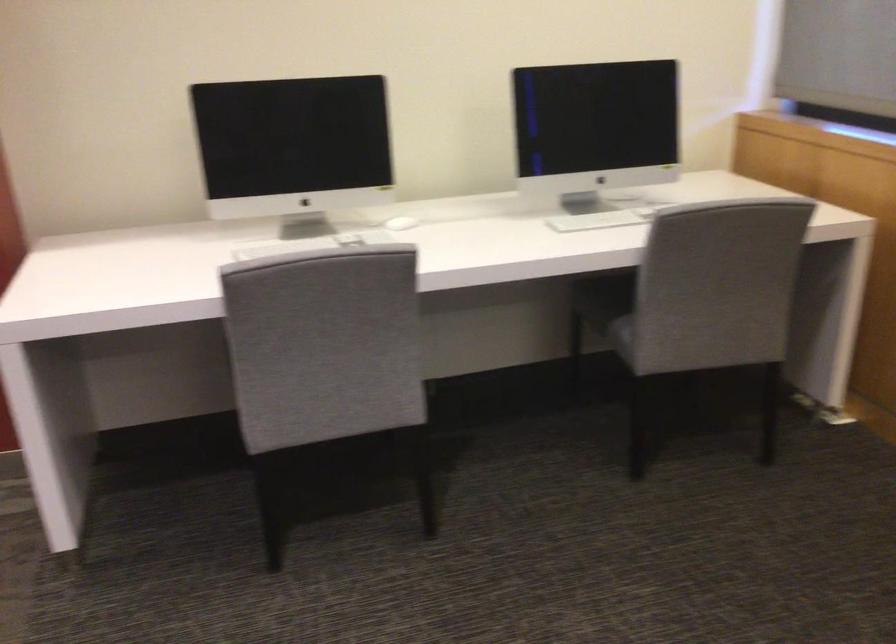
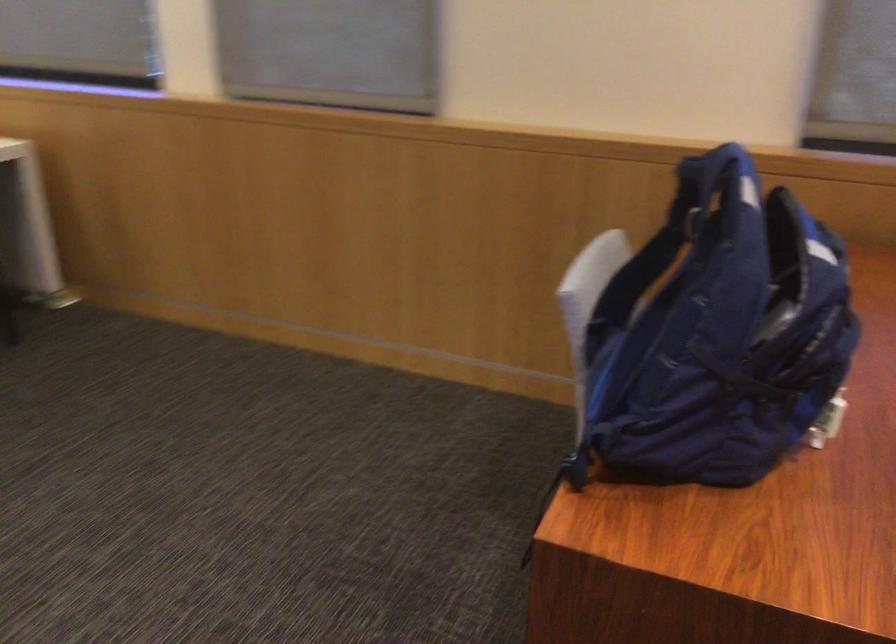
Question: Based on the continuous images, in which direction is the camera rotating? Reply with the corresponding letter.

Choices:
 (A) Left
 (B) Right
 (C) Up
 (D) Down

Answer: (B)